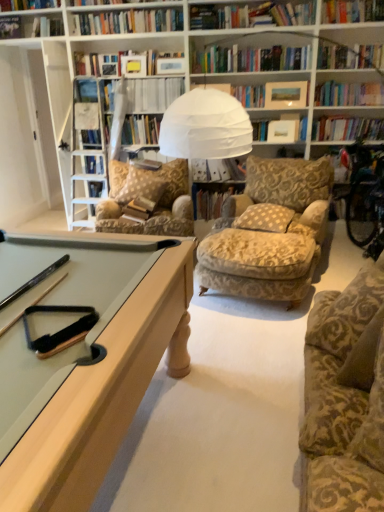
Question: Does hardcover book at upper center, which is the 4th book from bottom to top, have a greater width compared to white paper at upper center, arranged as the third book when ordered from the bottom?

Choices:
 (A) yes
 (B) no

Answer: (B)

Question: Is hardcover book at upper center, the first book when ordered from top to bottom, to the left of white paper at upper center, arranged as the second book when viewed from the top, from the viewer's perspective?

Choices:
 (A) no
 (B) yes

Answer: (B)

Question: Would you consider hardcover book at upper center, which is the 4th book from bottom to top, to be distant from white paper at upper center, arranged as the second book when viewed from the top?

Choices:
 (A) yes
 (B) no

Answer: (B)

Question: Is white paper at upper center, arranged as the third book when ordered from the bottom, inside hardcover book at upper center, the first book when ordered from top to bottom?

Choices:
 (A) yes
 (B) no

Answer: (B)

Question: Is hardcover book at upper center, which is the 4th book from bottom to top, beside white paper at upper center, arranged as the third book when ordered from the bottom?

Choices:
 (A) no
 (B) yes

Answer: (A)

Question: From a real-world perspective, is patterned fabric pillow at center, acting as the 1th pillow starting from the right, above or below hardcover book at center, which appears as the fourth book when viewed from the top?

Choices:
 (A) below
 (B) above

Answer: (B)

Question: From the image's perspective, is patterned fabric pillow at center, which is the 2th pillow from back to front, located above or below hardcover book at center, which appears as the fourth book when viewed from the top?

Choices:
 (A) above
 (B) below

Answer: (B)

Question: Considering the positions of point (279, 227) and point (213, 190), is point (279, 227) closer or farther from the camera than point (213, 190)?

Choices:
 (A) closer
 (B) farther

Answer: (A)

Question: Looking at the image, does patterned fabric pillow at center, the first pillow from the front, seem bigger or smaller compared to hardcover book at center, which appears as the fourth book when viewed from the top?

Choices:
 (A) small
 (B) big

Answer: (A)

Question: From the image's perspective, relative to hardcover book at upper center, which is the 4th book from bottom to top, is white paper at upper center, arranged as the third book when ordered from the bottom, above or below?

Choices:
 (A) above
 (B) below

Answer: (B)

Question: Looking at their shapes, would you say white paper at upper center, arranged as the second book when viewed from the top, is wider or thinner than hardcover book at upper center, the first book when ordered from top to bottom?

Choices:
 (A) wide
 (B) thin

Answer: (A)

Question: From a real-world perspective, is white paper at upper center, arranged as the third book when ordered from the bottom, physically located above or below hardcover book at upper center, the first book when ordered from top to bottom?

Choices:
 (A) below
 (B) above

Answer: (A)

Question: Is white paper at upper center, arranged as the second book when viewed from the top, taller or shorter than hardcover book at upper center, which is the 4th book from bottom to top?

Choices:
 (A) short
 (B) tall

Answer: (B)

Question: Which is correct: hardcover book at center, which appears as the fourth book when viewed from the top, is inside gold-patterned fabric chair at center, or outside of it?

Choices:
 (A) inside
 (B) outside

Answer: (B)

Question: From the image's perspective, is hardcover book at center, positioned as the 1th book in bottom-to-top order, located above or below gold-patterned fabric chair at center?

Choices:
 (A) below
 (B) above

Answer: (A)